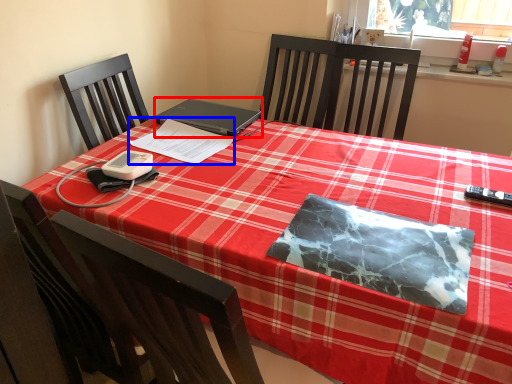
Question: Among these objects, which one is nearest to the camera, laptop (highlighted by a red box) or notebook (highlighted by a blue box)?

Choices:
 (A) laptop
 (B) notebook

Answer: (B)